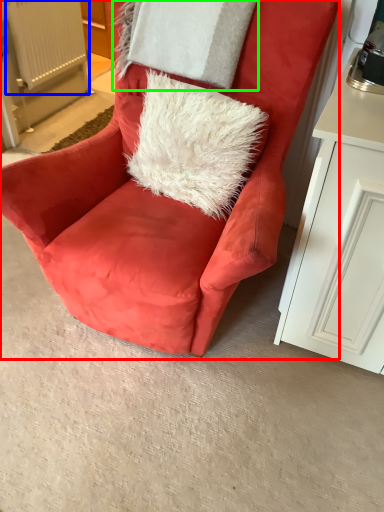
Question: Which is nearer to the chair (highlighted by a red box)? radiator (highlighted by a blue box) or pillow (highlighted by a green box).

Choices:
 (A) radiator
 (B) pillow

Answer: (B)